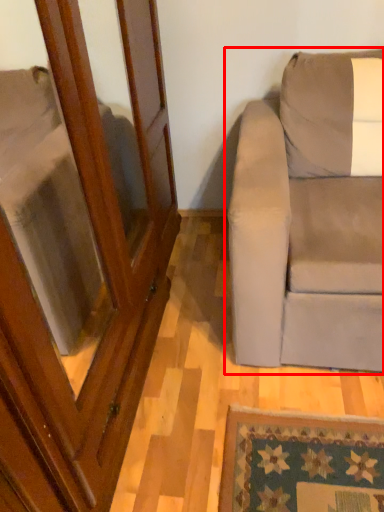
Question: From the image's perspective, where is studio couch (annotated by the red box) located relative to screen door?

Choices:
 (A) above
 (B) below

Answer: (A)